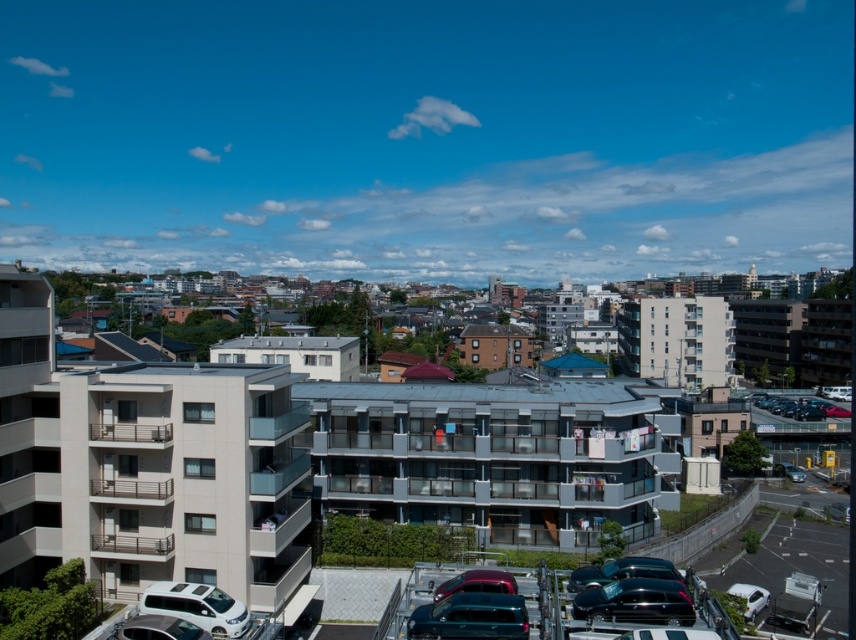
Question: Does teal glossy car at lower center appear on the right side of shiny red car at center?

Choices:
 (A) yes
 (B) no

Answer: (B)

Question: Which point is farther to the camera?

Choices:
 (A) (527, 627)
 (B) (684, 595)

Answer: (B)

Question: Which point is farther to the camera?

Choices:
 (A) (673, 614)
 (B) (177, 625)
 (C) (421, 616)

Answer: (B)

Question: Is white matte van at lower left smaller than silver metallic car at lower left?

Choices:
 (A) yes
 (B) no

Answer: (A)

Question: Is silver metallic car at lower left bigger than metallic silver car at lower right?

Choices:
 (A) yes
 (B) no

Answer: (B)

Question: Based on their relative distances, which object is nearer to the teal glossy car at lower center?

Choices:
 (A) metallic silver car at lower right
 (B) white glossy car at lower right
 (C) silver metallic car at lower left

Answer: (C)